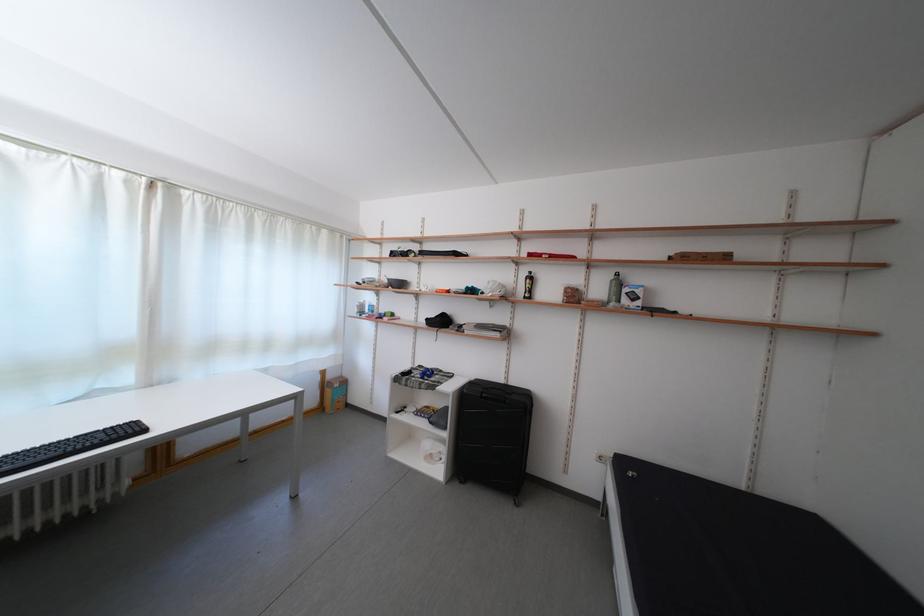
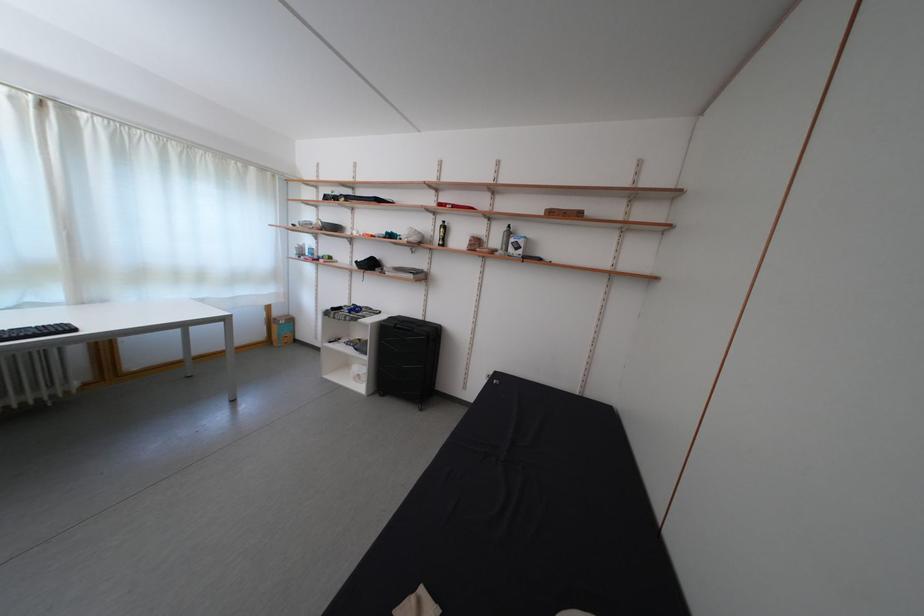
In the second image, find the point that corresponds to pixel 338 382 in the first image.

(285, 320)